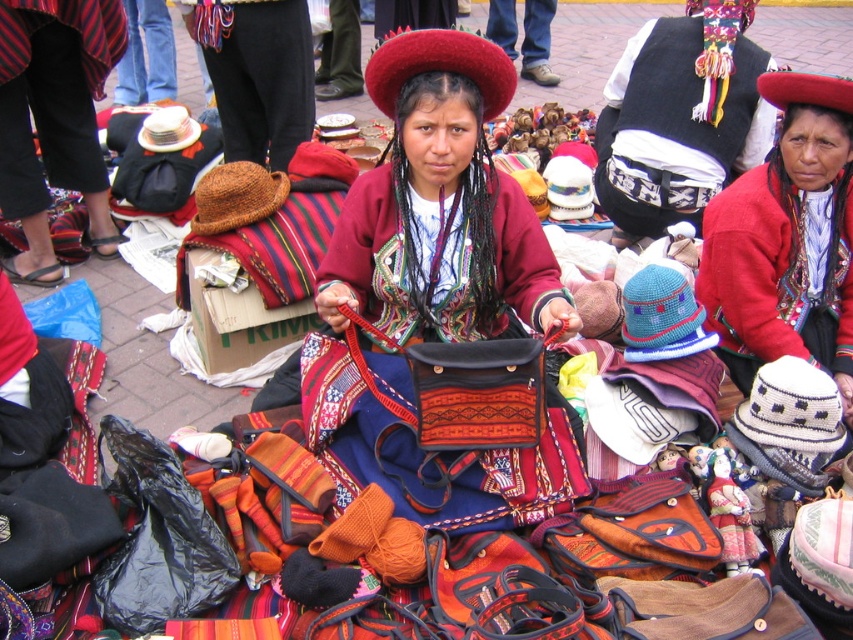
Can you confirm if knitted wool hat at center is positioned to the right of denim pants at center?

Indeed, knitted wool hat at center is positioned on the right side of denim pants at center.

Which is above, knitted wool hat at center or denim pants at center?

denim pants at center

Is point (813, 92) closer to camera compared to point (503, 36)?

Yes, point (813, 92) is in front of point (503, 36).

At what (x,y) coordinates should I click in order to perform the action: click on knitted wool hat at center. Please return your answer as a coordinate pair (x, y). Looking at the image, I should click on (787, 241).

Between black knit hat at upper center and jeans at center, which one is positioned lower?

Positioned lower is black knit hat at upper center.

Based on the photo, does black knit hat at upper center appear on the right side of jeans at center?

Correct, you'll find black knit hat at upper center to the right of jeans at center.

Who is more forward, (257,54) or (138,60)?

Point (257,54) is more forward.

Locate an element on the screen. This screenshot has height=640, width=853. black knit hat at upper center is located at coordinates (257, 74).

Can you confirm if black fabric pants at lower left is positioned above denim pants at center?

No.

Which of these two, black fabric pants at lower left or denim pants at center, stands shorter?

With less height is denim pants at center.

Between point (3, 60) and point (538, 10), which one is positioned in front?

Point (3, 60) is more forward.

Image resolution: width=853 pixels, height=640 pixels. I want to click on black fabric pants at lower left, so click(53, 96).